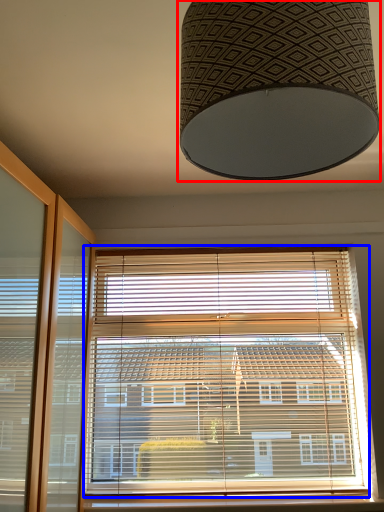
Question: Which of the following is the closest to the observer, lamp (highlighted by a red box) or window blind (highlighted by a blue box)?

Choices:
 (A) lamp
 (B) window blind

Answer: (A)